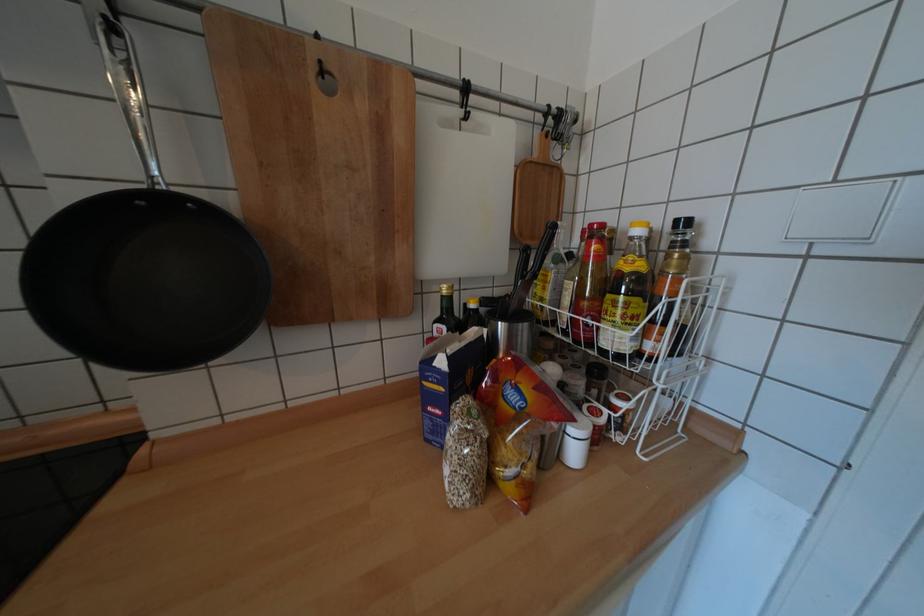
This screenshot has height=616, width=924. What do you see at coordinates (129, 92) in the screenshot? I see `the silver pan handle` at bounding box center [129, 92].